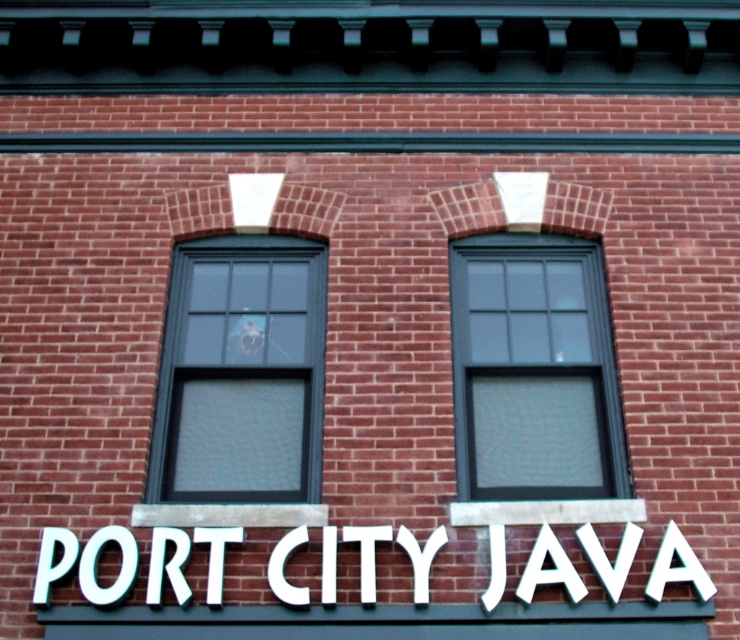
Question: Based on their relative distances, which object is farther from the matte glass window at center-left?

Choices:
 (A) white plastic sign at center
 (B) matte black window at center

Answer: (B)

Question: Where is matte glass window at center-left located in relation to white plastic sign at center in the image?

Choices:
 (A) left
 (B) right

Answer: (B)

Question: Which point is closer to the camera?

Choices:
 (A) (562, 579)
 (B) (309, 424)

Answer: (A)

Question: Which object is closer to the camera taking this photo?

Choices:
 (A) white plastic sign at center
 (B) matte glass window at center-left
 (C) matte black window at center

Answer: (A)

Question: Can you confirm if matte glass window at center-left is positioned to the right of matte black window at center?

Choices:
 (A) yes
 (B) no

Answer: (B)

Question: Observing the image, what is the correct spatial positioning of matte black window at center in reference to white plastic sign at center?

Choices:
 (A) left
 (B) right

Answer: (B)